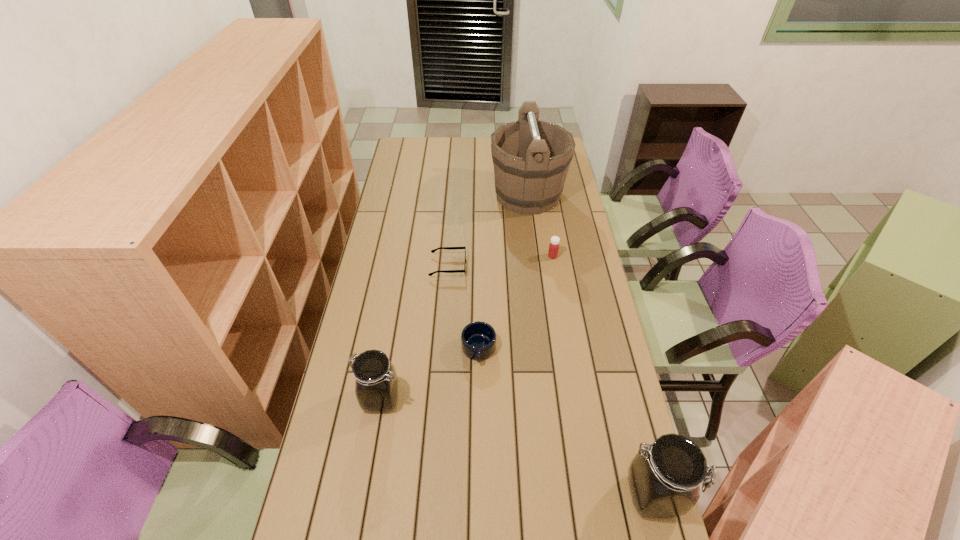
You are a GUI agent. You are given a task and a screenshot of the screen. Output one action in this format:
    pyautogui.click(x=<x>, y=<y>)
    Task: Click on the blank area at the near edge
    
    Given the screenshot: What is the action you would take?
    pyautogui.click(x=443, y=518)

Image resolution: width=960 pixels, height=540 pixels. In the image, there is a desktop. Identify the location of vacant space at the left edge. (381, 324).

At what (x,y) coordinates should I click in order to perform the action: click on vacant space at the right edge of the desktop. Please return your answer as a coordinate pair (x, y). This screenshot has height=540, width=960. Looking at the image, I should click on (582, 436).

In the image, there is a desktop. Identify the location of free region at the near left corner. The height and width of the screenshot is (540, 960). (315, 506).

Where is `vacant area between the farther jar and the fourth farthest object`? This screenshot has width=960, height=540. vacant area between the farther jar and the fourth farthest object is located at coordinates (430, 374).

Locate an element on the screen. Image resolution: width=960 pixels, height=540 pixels. vacant area that lies between the second nearest object and the nearer jar is located at coordinates (516, 447).

The width and height of the screenshot is (960, 540). I want to click on vacant space that is in between the nearest object and the second nearest object, so click(516, 447).

I want to click on free spot between the nearest object and the spectacles, so click(550, 380).

Find the location of a particular element. The height and width of the screenshot is (540, 960). free spot between the spectacles and the second tallest object is located at coordinates click(550, 380).

Where is `free spot between the right jar and the farther jar`? The height and width of the screenshot is (540, 960). free spot between the right jar and the farther jar is located at coordinates (516, 447).